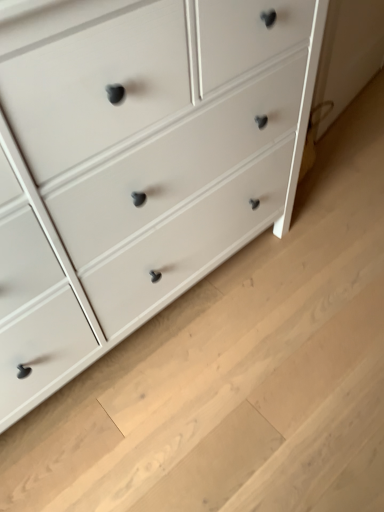
The height and width of the screenshot is (512, 384). Identify the location of white painted wood chest of drawers at center. click(x=138, y=165).

What do you see at coordinates (138, 165) in the screenshot? I see `white painted wood chest of drawers at center` at bounding box center [138, 165].

I want to click on white painted wood chest of drawers at center, so click(x=138, y=165).